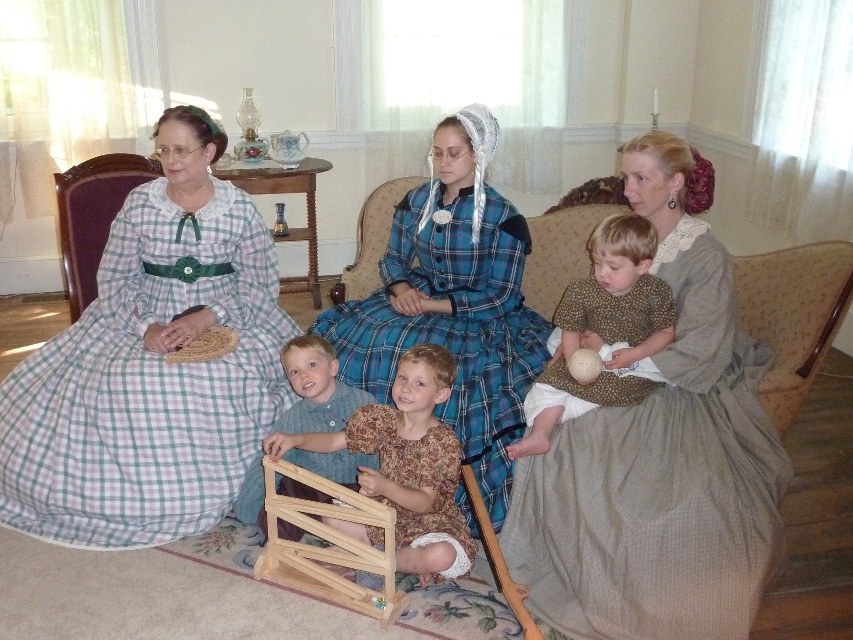
You are an interior designer planning to place a new lamp in the room. You have two options for placement coordinates. The first option is at point (109, 307) and the second is at point (706, 426). Which point is closer to the viewer and thus better for visibility?

Point (109, 307) is closer to the viewer than point (706, 426), so placing the lamp there would provide better visibility.

Which object is located at the coordinates point (660, 481)?

The matte gray dress at right is located at the coordinates point (660, 481).